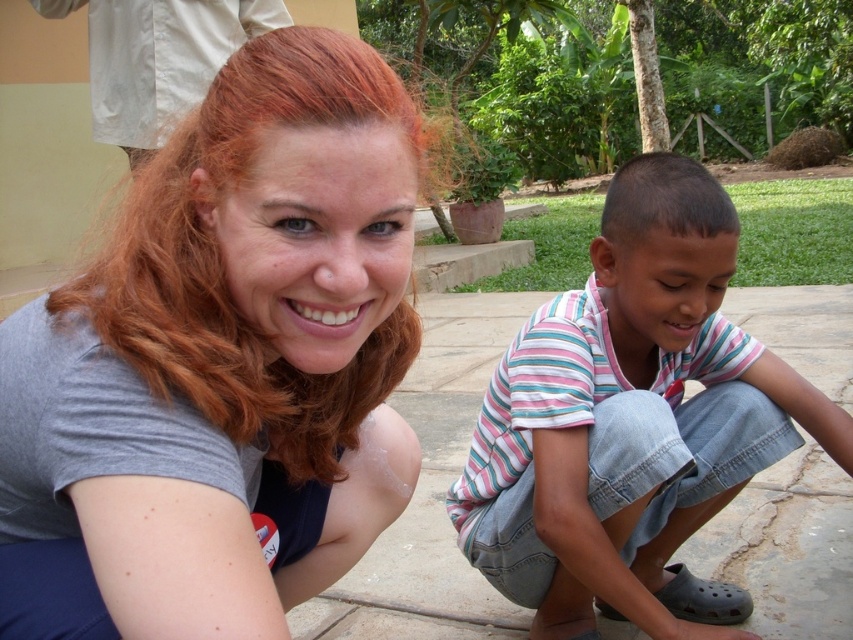
Is point (364, 109) positioned after point (96, 122)?

No, it is in front of (96, 122).

Which is in front, point (177, 572) or point (213, 0)?

Positioned in front is point (177, 572).

Between point (312, 243) and point (270, 22), which one is positioned in front?

Point (312, 243) is more forward.

Where is `gray matte shirt at upper left`? gray matte shirt at upper left is located at coordinates (230, 348).

Can you confirm if striped cotton shirt at lower right is thinner than white fabric at upper left?

Correct, striped cotton shirt at lower right's width is less than white fabric at upper left's.

Describe the element at coordinates (631, 422) in the screenshot. I see `striped cotton shirt at lower right` at that location.

Describe the element at coordinates (631, 422) in the screenshot. I see `striped cotton shirt at lower right` at that location.

Identify the location of striped cotton shirt at lower right. This screenshot has width=853, height=640. (631, 422).

Can you confirm if gray matte shirt at upper left is positioned to the left of striped cotton shirt at lower right?

Correct, you'll find gray matte shirt at upper left to the left of striped cotton shirt at lower right.

Is point (16, 419) positioned behind point (543, 461)?

No, (16, 419) is closer to viewer.

Find the location of a particular element. gray matte shirt at upper left is located at coordinates (230, 348).